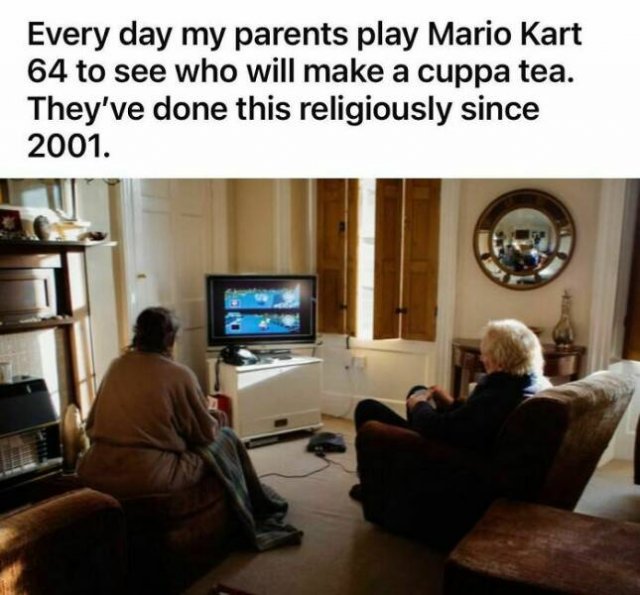
The image size is (640, 595). Find the location of `mantle`. mantle is located at coordinates (33, 243).